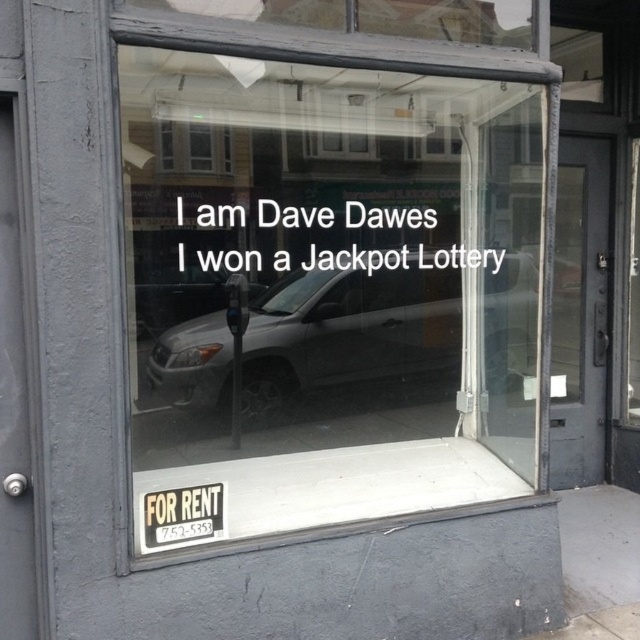
Question: Can you confirm if transparent glass sign at center is positioned to the right of gray matte suv at center?

Choices:
 (A) no
 (B) yes

Answer: (A)

Question: Is transparent glass sign at center above gray matte suv at center?

Choices:
 (A) yes
 (B) no

Answer: (A)

Question: Among these points, which one is farthest from the camera?

Choices:
 (A) (260, 337)
 (B) (237, 378)
 (C) (388, 227)
 (D) (388, 180)

Answer: (D)

Question: Which of the following is the farthest from the observer?

Choices:
 (A) gray matte suv at center
 (B) white paper text at center

Answer: (A)

Question: Does transparent glass sign at center come in front of gray matte suv at center?

Choices:
 (A) no
 (B) yes

Answer: (B)

Question: Which point is farther to the camera?

Choices:
 (A) (244, 307)
 (B) (189, 224)
 (C) (387, 301)
 (D) (276, 220)

Answer: (C)